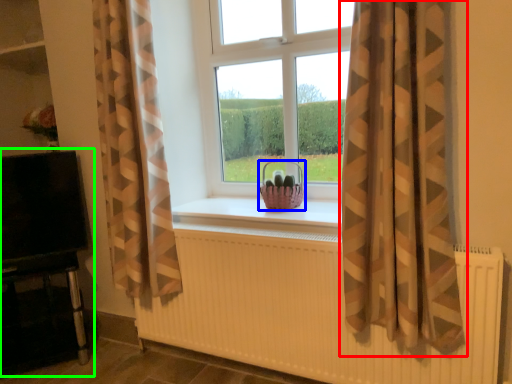
Question: Which is nearer to the curtain (highlighted by a red box)? basket (highlighted by a blue box) or entertainment center (highlighted by a green box).

Choices:
 (A) basket
 (B) entertainment center

Answer: (A)